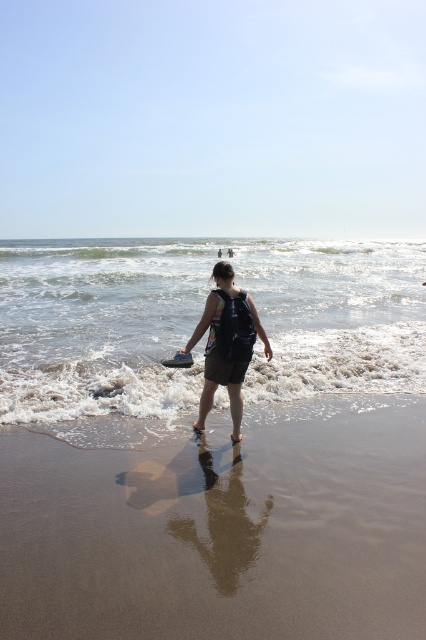
Question: Is brown sandy beach at lower center to the right of matte black backpack at center from the viewer's perspective?

Choices:
 (A) no
 (B) yes

Answer: (B)

Question: Based on their relative distances, which object is nearer to the matte black backpack at center?

Choices:
 (A) foamy white water at lower center
 (B) brown sandy beach at lower center

Answer: (B)

Question: Is brown sandy beach at lower center smaller than foamy white water at lower center?

Choices:
 (A) yes
 (B) no

Answer: (A)

Question: Is brown sandy beach at lower center closer to the viewer compared to foamy white water at lower center?

Choices:
 (A) yes
 (B) no

Answer: (A)

Question: Which object appears farthest from the camera in this image?

Choices:
 (A) matte black backpack at center
 (B) brown sandy beach at lower center

Answer: (A)

Question: Estimate the real-world distances between objects in this image. Which object is closer to the brown sandy beach at lower center?

Choices:
 (A) foamy white water at lower center
 (B) matte black backpack at center

Answer: (B)